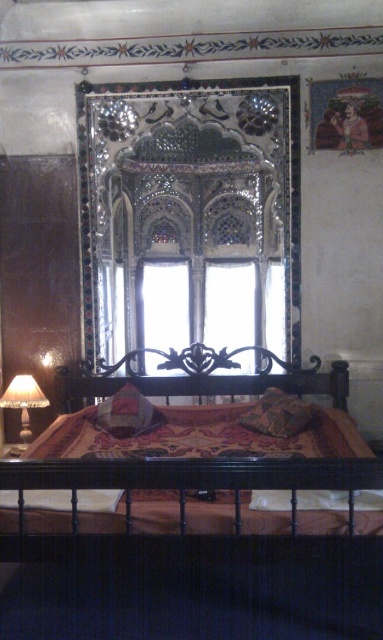
Question: Among these objects, which one is nearest to the camera?

Choices:
 (A) black wrought iron headboard at center
 (B) translucent glass lampshade at left
 (C) shiny mosaic wall at center
 (D) patterned fabric pillow at center

Answer: (D)

Question: Can you confirm if wooden bed at center is positioned above patterned fabric bedspread at center?

Choices:
 (A) yes
 (B) no

Answer: (B)

Question: Which point is closer to the camera?

Choices:
 (A) (114, 600)
 (B) (27, 403)

Answer: (A)

Question: Does black wrought iron headboard at center appear on the right side of translucent glass lampshade at left?

Choices:
 (A) yes
 (B) no

Answer: (A)

Question: Can you confirm if wooden bed at center is wider than black wrought iron headboard at center?

Choices:
 (A) no
 (B) yes

Answer: (A)

Question: Estimate the real-world distances between objects in this image. Which object is closer to the translucent glass lampshade at left?

Choices:
 (A) wooden bed at center
 (B) shiny mosaic wall at center
 (C) velvet-like brown pillow at center
 (D) patterned fabric bedspread at center

Answer: (C)